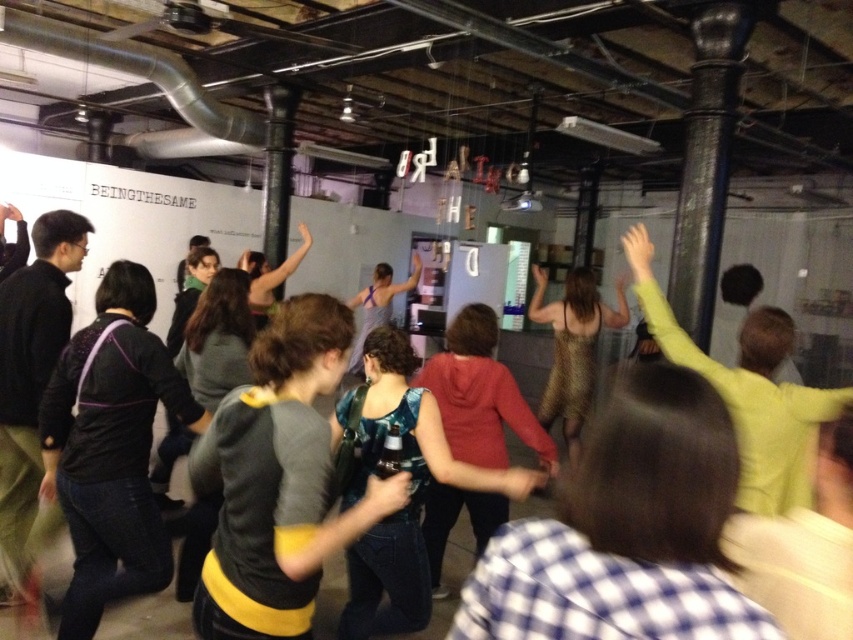
You are at the coordinates point 0.5,0.5 in the image. You want to move to the light green sweater at upper right. Which direction should you move in?

You should move northeast to reach the light green sweater at upper right.

You are a photographer at the event and want to capture both the checkered shirt at center and the gold sequined dress at center in a single frame. Which object should you focus on first to ensure both are in the frame?

You should focus on the gold sequined dress at center first because it is wider than the checkered shirt at center, so centering it will ensure the narrower checkered shirt at center also stays within the frame.

In the scene shown: You are at the event and want to find the light green sweater at upper right and the black matte jacket at left. Which one is shorter in height?

The light green sweater at upper right has a lesser height compared to the black matte jacket at left, so the light green sweater at upper right is shorter.